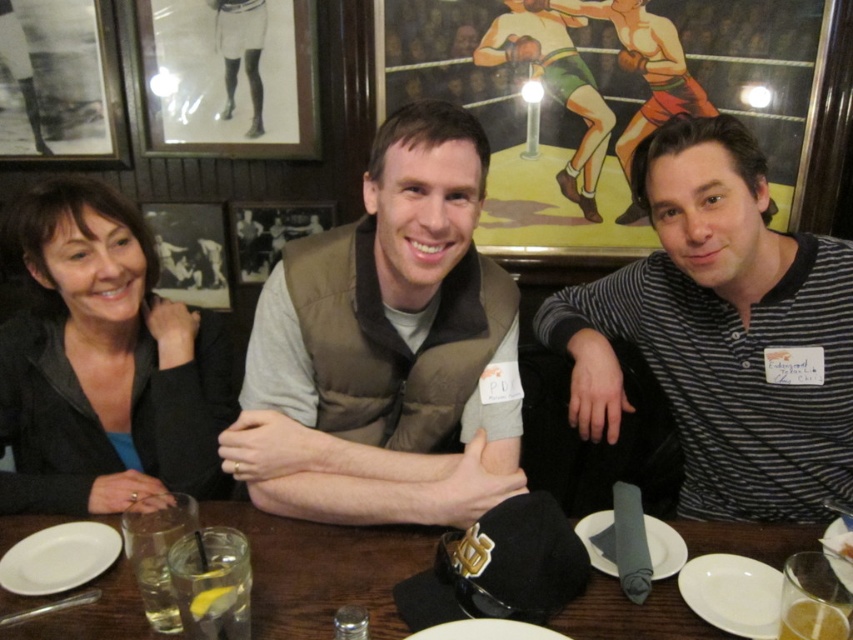
Question: Can you confirm if brown fuzzy vest at center is positioned to the left of green fabric boxer at upper center?

Choices:
 (A) yes
 (B) no

Answer: (A)

Question: Is matte black blazer at left thinner than matte green shorts at center?

Choices:
 (A) yes
 (B) no

Answer: (A)

Question: Which of the following is the farthest from the observer?

Choices:
 (A) (660, 115)
 (B) (27, 474)
 (C) (567, 52)
 (D) (450, 234)

Answer: (A)

Question: Can you confirm if striped cotton shirt at right is wider than metallic silver picture frame at upper left?

Choices:
 (A) no
 (B) yes

Answer: (B)

Question: Which point appears farthest from the camera in this image?

Choices:
 (A) (583, 177)
 (B) (67, 321)
 (C) (9, 598)

Answer: (A)

Question: Which point appears closest to the camera in this image?

Choices:
 (A) click(426, 118)
 (B) click(762, 355)

Answer: (A)